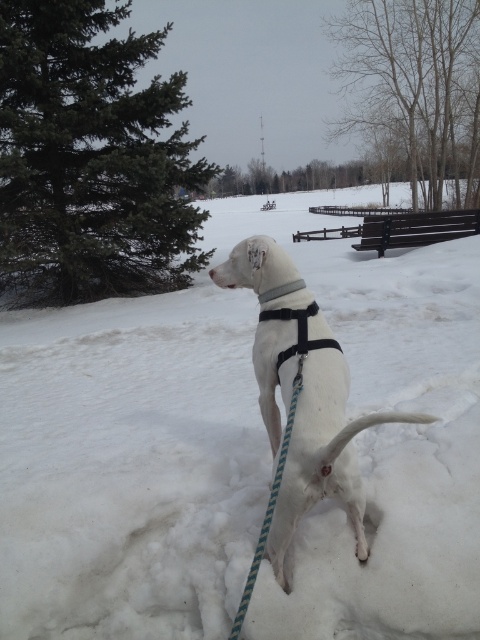
Question: Is the position of green textured pine tree at upper left more distant than that of black nylon neckband at center?

Choices:
 (A) no
 (B) yes

Answer: (B)

Question: Is white fluffy snow at center in front of white matte harness at center?

Choices:
 (A) no
 (B) yes

Answer: (A)

Question: Which point is farther to the camera?

Choices:
 (A) black nylon neckband at center
 (B) white matte harness at center
 (C) white fluffy snow at center
 (D) green textured pine tree at upper left

Answer: (D)

Question: Which is farther from the white matte harness at center?

Choices:
 (A) white fluffy snow at center
 (B) green textured pine tree at upper left

Answer: (B)

Question: Can you confirm if white fluffy snow at center is bigger than white matte harness at center?

Choices:
 (A) no
 (B) yes

Answer: (B)

Question: Which point is farther to the camera?

Choices:
 (A) black nylon neckband at center
 (B) green textured pine tree at upper left

Answer: (B)